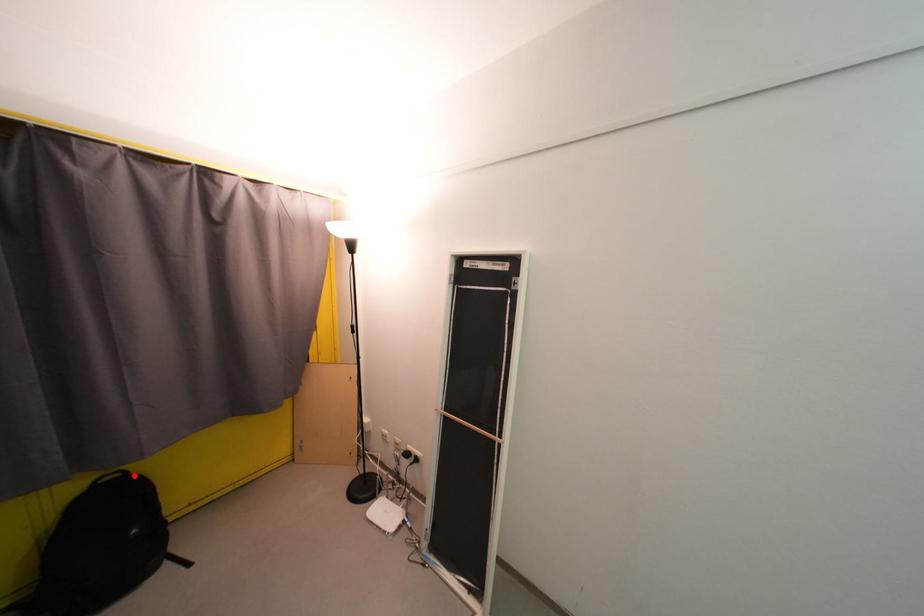
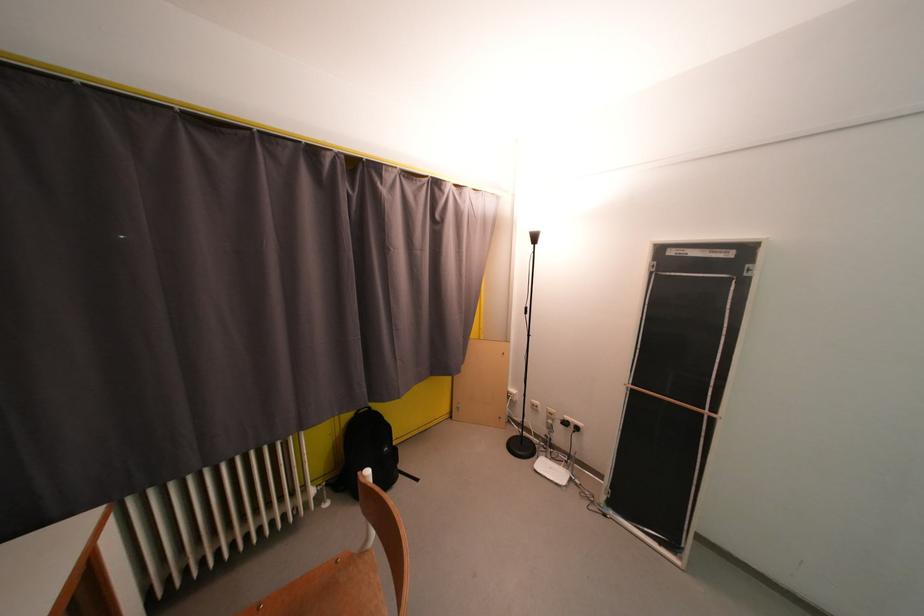
Question: I am providing you with two images of the same scene from different viewpoints. Given a red point in image1, look at the same physical point in image2. Is it:

Choices:
 (A) Closer to the viewpoint
 (B) Farther from the viewpoint

Answer: (B)